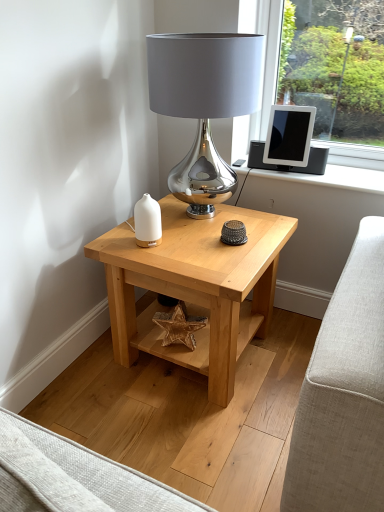
The image size is (384, 512). Identify the location of vacant region to the right of white matte vase at center. (189, 245).